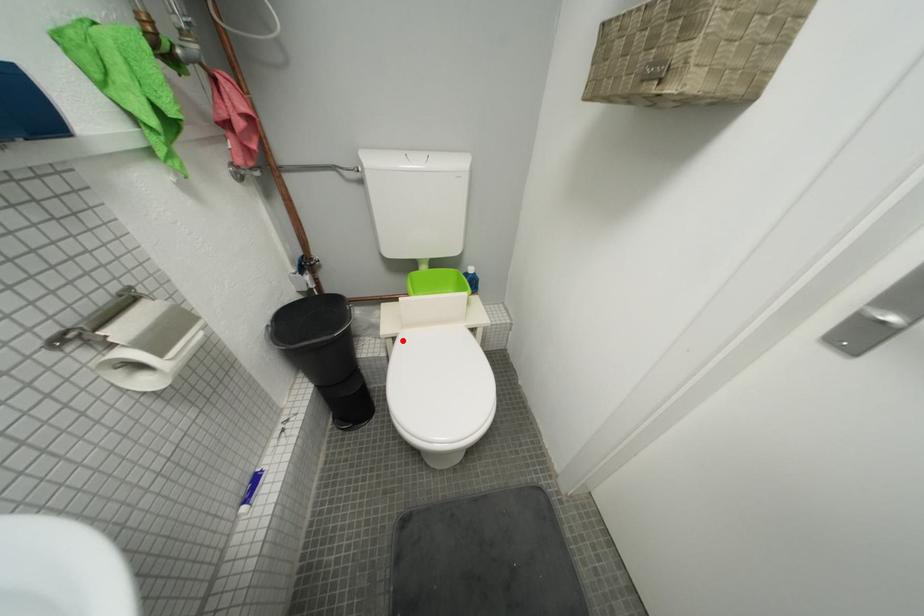
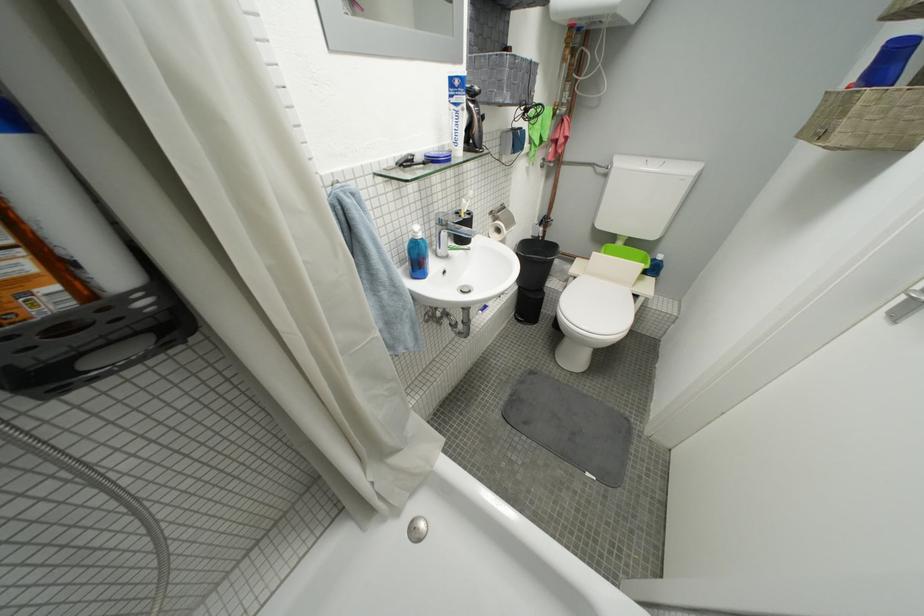
Locate, in the second image, the point that corresponds to the highlighted location in the first image.

(584, 281)